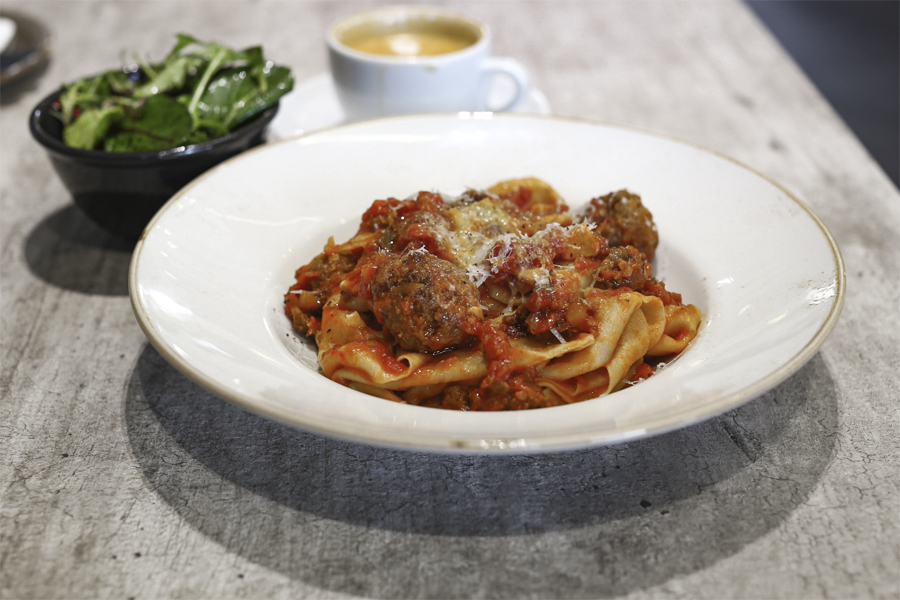
Where is `handle`? This screenshot has width=900, height=600. handle is located at coordinates (517, 86).